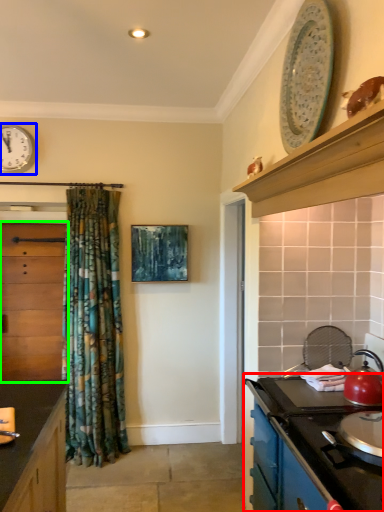
Question: Which is farther away from cabinetry (highlighted by a red box)? clock (highlighted by a blue box) or cabinetry (highlighted by a green box)?

Choices:
 (A) clock
 (B) cabinetry

Answer: (A)